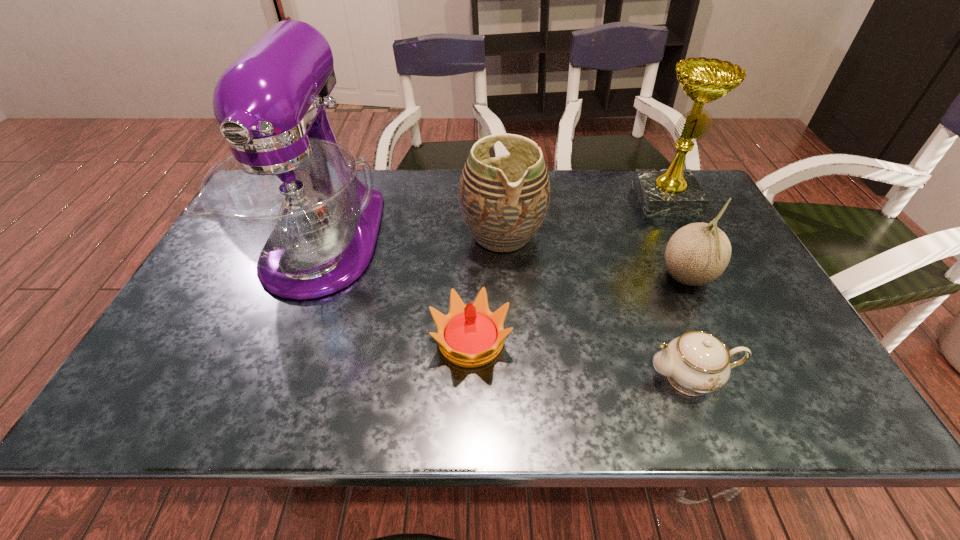
Locate an element on the screen. The width and height of the screenshot is (960, 540). empty space between the third tallest object and the mixer is located at coordinates (413, 238).

Identify the location of vacant area that lies between the chinaware and the second tallest object. pyautogui.click(x=678, y=288).

Image resolution: width=960 pixels, height=540 pixels. What are the coordinates of `free space between the crown and the mixer` in the screenshot? It's located at (397, 292).

This screenshot has height=540, width=960. I want to click on free spot between the award and the pottery, so [x=584, y=217].

Locate an element on the screen. Image resolution: width=960 pixels, height=540 pixels. vacant area that lies between the tallest object and the crown is located at coordinates point(397,292).

Choose which object is the third nearest neighbor to the chinaware. Please provide its 2D coordinates. Your answer should be formatted as a tuple, i.e. [(x, y)], where the tuple contains the x and y coordinates of a point satisfying the conditions above.

[(504, 200)]

Identify the location of the second closest object to the fourth shortest object. The height and width of the screenshot is (540, 960). (289, 198).

Identify the location of free space that satisfies the following two spatial constraints: 1. on the front side of the cantaloup; 2. on the left side of the fourth shortest object. The width and height of the screenshot is (960, 540). (505, 279).

Where is `free spot that satisfies the following two spatial constraints: 1. at the bowl opening of the tallest object; 2. on the right side of the crown`? The height and width of the screenshot is (540, 960). free spot that satisfies the following two spatial constraints: 1. at the bowl opening of the tallest object; 2. on the right side of the crown is located at coordinates (285, 341).

Where is `vacant space that satisfies the following two spatial constraints: 1. on the front-facing side of the award; 2. at the spout of the chinaware`? vacant space that satisfies the following two spatial constraints: 1. on the front-facing side of the award; 2. at the spout of the chinaware is located at coordinates (756, 377).